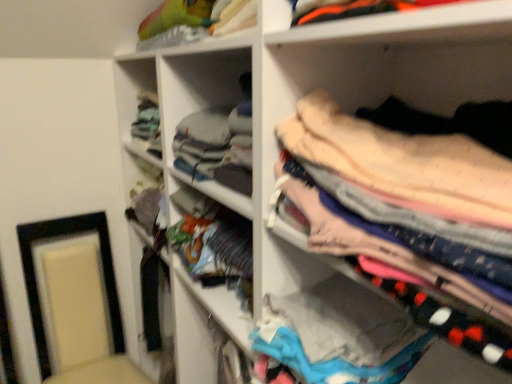
Question: Considering the positions of matte black picture frame at lower left and soft pink fabric at upper right in the image, is matte black picture frame at lower left taller or shorter than soft pink fabric at upper right?

Choices:
 (A) tall
 (B) short

Answer: (A)

Question: Is matte black picture frame at lower left bigger or smaller than soft pink fabric at upper right?

Choices:
 (A) small
 (B) big

Answer: (B)

Question: From a real-world perspective, relative to soft pink fabric at upper right, is matte black picture frame at lower left vertically above or below?

Choices:
 (A) above
 (B) below

Answer: (B)

Question: From a real-world perspective, relative to matte black picture frame at lower left, is soft pink fabric at upper right vertically above or below?

Choices:
 (A) below
 (B) above

Answer: (B)

Question: Is soft pink fabric at upper right inside or outside of matte black picture frame at lower left?

Choices:
 (A) inside
 (B) outside

Answer: (B)

Question: Considering the positions of soft pink fabric at upper right and matte black picture frame at lower left in the image, is soft pink fabric at upper right taller or shorter than matte black picture frame at lower left?

Choices:
 (A) short
 (B) tall

Answer: (A)

Question: Is point (449, 236) closer or farther from the camera than point (119, 319)?

Choices:
 (A) farther
 (B) closer

Answer: (B)